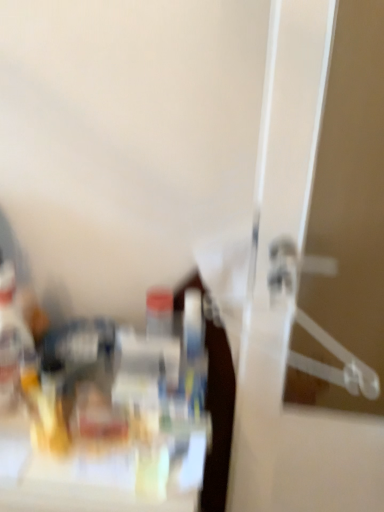
Question: Is translucent plastic bottle at left spatially inside clear plastic hanger at right, or outside of it?

Choices:
 (A) outside
 (B) inside

Answer: (A)

Question: Visually, is translucent plastic bottle at left positioned to the left or to the right of clear plastic hanger at right?

Choices:
 (A) left
 (B) right

Answer: (A)

Question: Considering their positions, is translucent plastic bottle at left located in front of or behind clear plastic hanger at right?

Choices:
 (A) front
 (B) behind

Answer: (B)

Question: Looking at their shapes, would you say clear plastic hanger at right is wider or thinner than translucent plastic bottle at left?

Choices:
 (A) wide
 (B) thin

Answer: (B)

Question: Relative to translucent plastic bottle at left, is clear plastic hanger at right in front or behind?

Choices:
 (A) behind
 (B) front

Answer: (B)

Question: From the image's perspective, is clear plastic hanger at right located above or below translucent plastic bottle at left?

Choices:
 (A) below
 (B) above

Answer: (B)

Question: Choose the correct answer: Is clear plastic hanger at right inside translucent plastic bottle at left or outside it?

Choices:
 (A) outside
 (B) inside

Answer: (A)